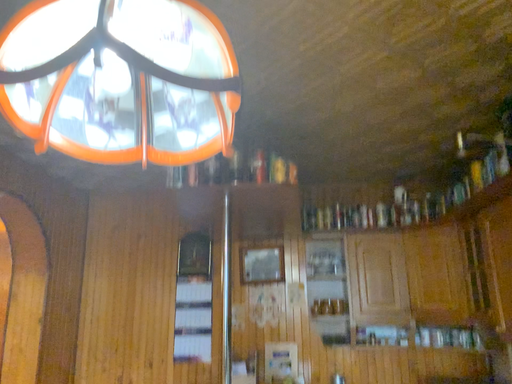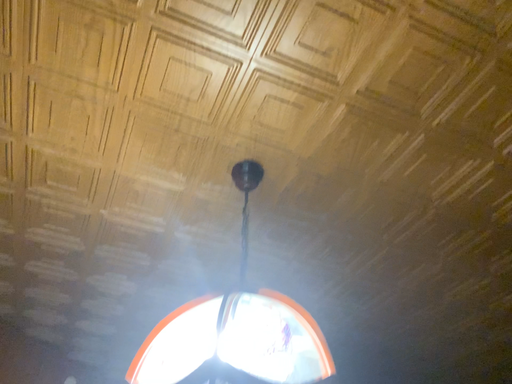
Question: Which way did the camera rotate in the video?

Choices:
 (A) rotated left
 (B) rotated right

Answer: (A)